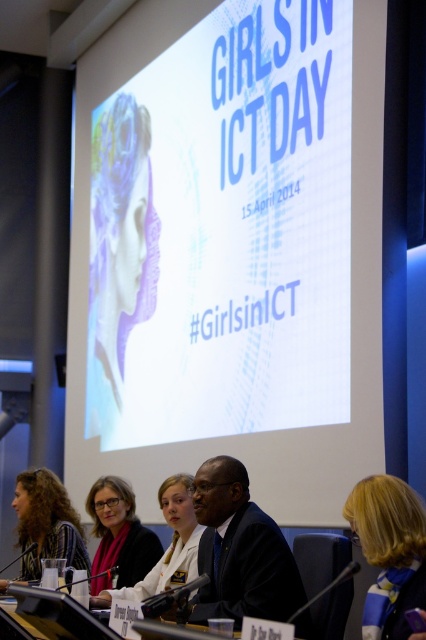
You are a photographer positioned at the back of the room. You need to capture a photo that includes both the white matte projection screen at upper center and the blonde hair at lower right. Given that your camera has a maximum focus range of 2 meters, will you be able to capture both subjects in focus without moving your position?

The white matte projection screen at upper center is 2.28 meters away from blonde hair at lower right. Since the distance between them exceeds the camera maximum focus range of 2 meters, you will not be able to capture both subjects in focus without moving your position.

You are a photographer at the event and need to place a small decorative item exactly at the point marked as point [230,250] on the white matte projection screen at upper center. Where should you place it relative to the screen?

The point [230,250] is located on the white matte projection screen at upper center, so you should place the decorative item directly on the screen at that coordinate.

You are organizing a presentation and need to ensure that the microphone on the table can reach both the speaker at the matte black jacket at lower left and the white matte projection screen at upper center. The microphone has a range of 5 feet. Can both be reached by the microphone?

The white matte projection screen at upper center and the matte black jacket at lower left are 5.74 feet apart from each other. Since the microphone has a range of 5 feet, the distance between them exceeds the microphone range. Therefore, the microphone cannot reach both simultaneously.